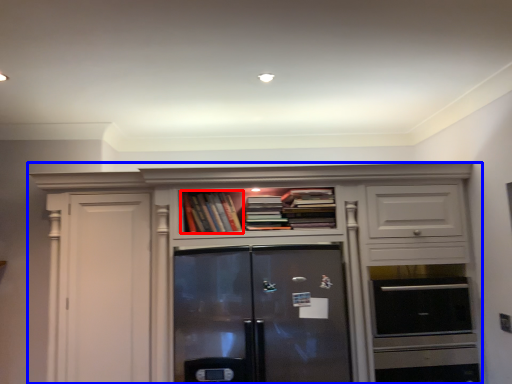
Question: Which point is closer to the camera, book (highlighted by a red box) or cabinetry (highlighted by a blue box)?

Choices:
 (A) book
 (B) cabinetry

Answer: (B)